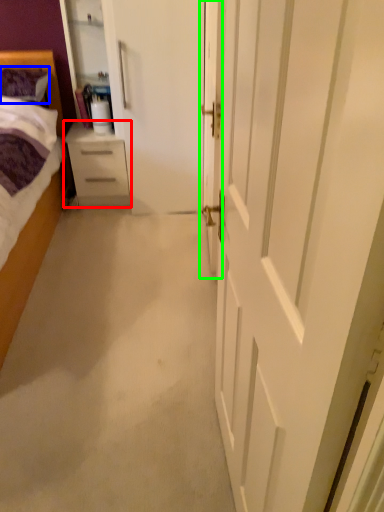
Question: Which is farther away from chest of drawers (highlighted by a red box)? pillow (highlighted by a blue box) or door (highlighted by a green box)?

Choices:
 (A) pillow
 (B) door

Answer: (B)